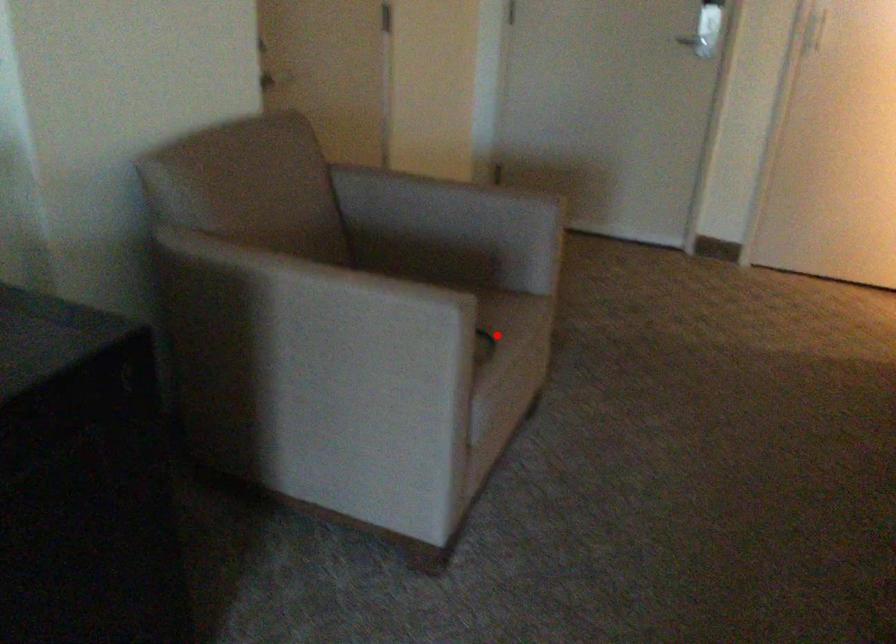
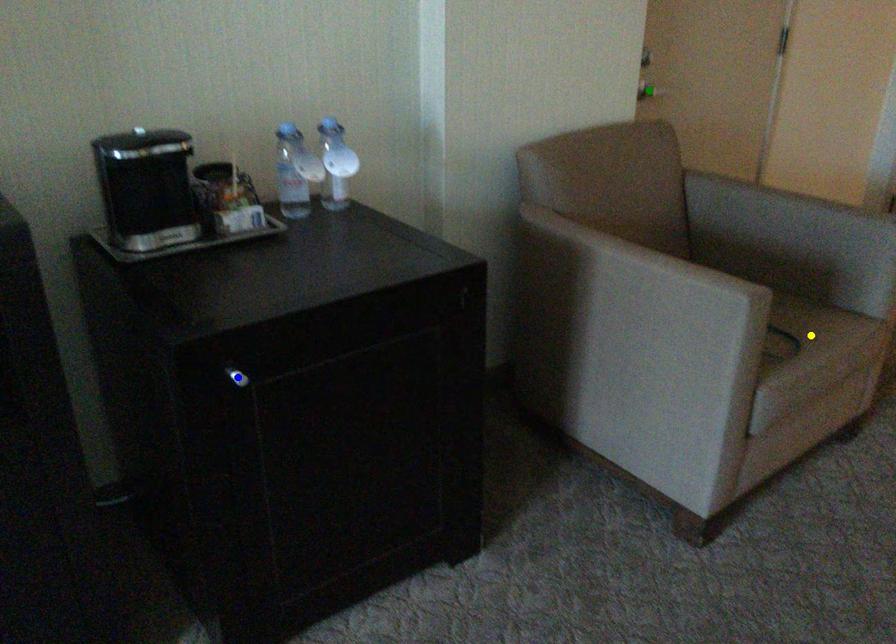
Question: I am providing you with two images of the same scene from different viewpoints. A red point is marked on the first image. You are given multiple points on the second image. Which point in image 2 represents the same 3d spot as the red point in image 1?

Choices:
 (A) blue point
 (B) yellow point
 (C) green point

Answer: (B)